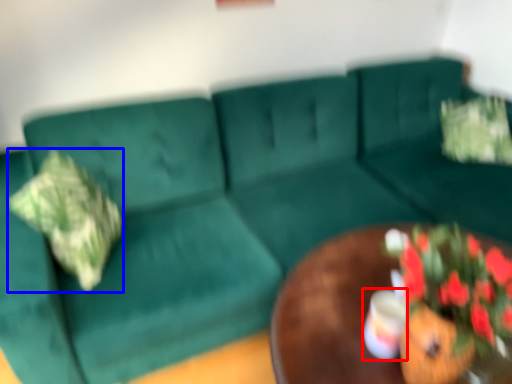
Question: Which point is closer to the camera, coffee cup (highlighted by a red box) or pillow (highlighted by a blue box)?

Choices:
 (A) coffee cup
 (B) pillow

Answer: (A)